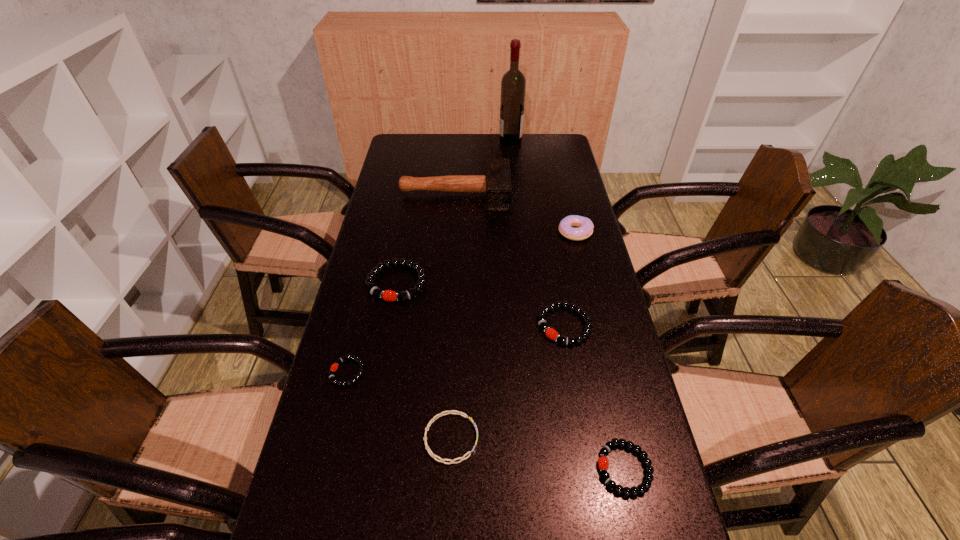
Locate an element on the screen. free space between the pink doughnut and the tallest bracelet is located at coordinates (486, 258).

Identify the location of vacant space in between the second tallest bracelet and the third bracelet from right to left. click(x=508, y=382).

This screenshot has width=960, height=540. What are the coordinates of `free space between the second farthest bracelet and the smallest black bracelet` in the screenshot? It's located at (456, 349).

The height and width of the screenshot is (540, 960). Identify the location of empty space between the third farthest black bracelet and the third biggest black bracelet. (486, 420).

Where is `free point between the tallest object and the second tallest object`? The image size is (960, 540). free point between the tallest object and the second tallest object is located at coordinates (483, 167).

The width and height of the screenshot is (960, 540). Find the location of `free space between the second farthest bracelet and the second smallest black bracelet`. free space between the second farthest bracelet and the second smallest black bracelet is located at coordinates (594, 397).

Where is `free point between the second smallest black bracelet and the pink doughnut`? The height and width of the screenshot is (540, 960). free point between the second smallest black bracelet and the pink doughnut is located at coordinates (600, 350).

Where is `free spot between the second farthest bracelet and the third bracelet from right to left`? Image resolution: width=960 pixels, height=540 pixels. free spot between the second farthest bracelet and the third bracelet from right to left is located at coordinates (508, 382).

At what (x,y) coordinates should I click in order to perform the action: click on the fourth closest object to the second tallest object. Please return your answer as a coordinate pair (x, y). The height and width of the screenshot is (540, 960). Looking at the image, I should click on (550, 332).

Select which object is the closest to the fifth tallest object. Please provide its 2D coordinates. Your answer should be formatted as a tuple, i.e. [(x, y)], where the tuple contains the x and y coordinates of a point satisfying the conditions above.

[(448, 412)]